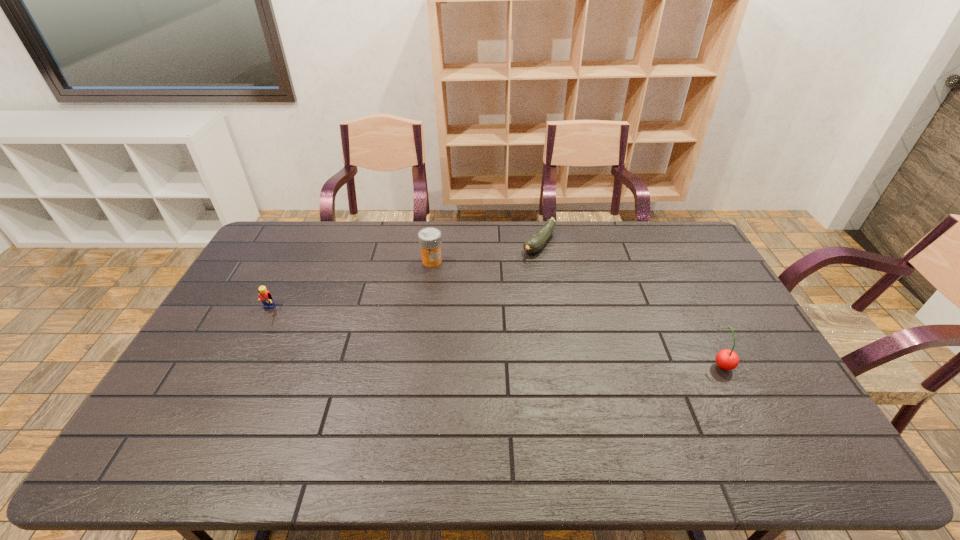
Where is `free space on the desktop that is between the leftmost object and the nearest object and is positioned at the blossom end of the shortest object`? This screenshot has height=540, width=960. free space on the desktop that is between the leftmost object and the nearest object and is positioned at the blossom end of the shortest object is located at coordinates (444, 332).

Identify the location of vacant space on the desktop that is between the leftmost object and the nearest object and is positioned on the label side of the medicine. (422, 330).